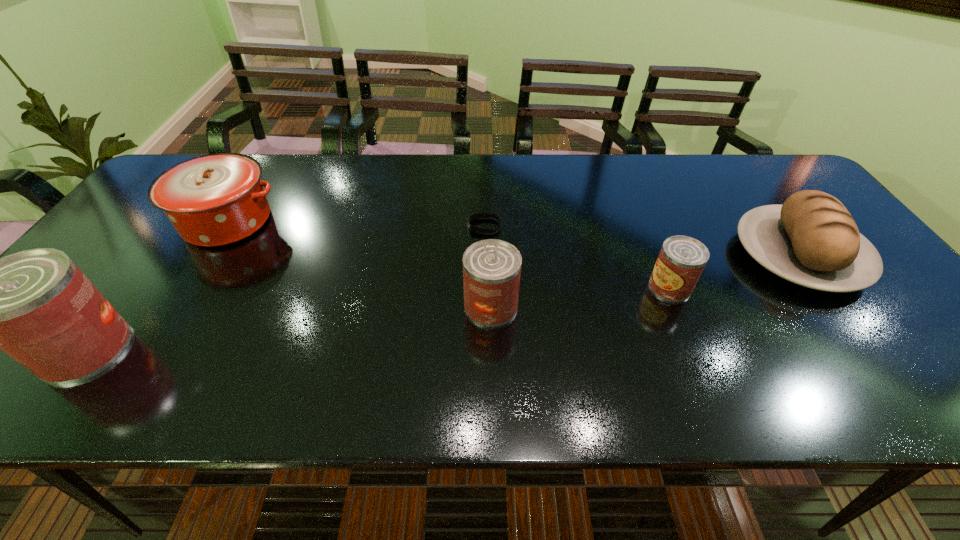
Find the location of a particular element. vacant space that satisfies the following two spatial constraints: 1. on the display of the shortest object; 2. on the left side of the bread is located at coordinates (485, 256).

The width and height of the screenshot is (960, 540). Identify the location of free location that satisfies the following two spatial constraints: 1. on the display of the shortest object; 2. on the front side of the tallest object. (486, 349).

This screenshot has width=960, height=540. I want to click on free point that satisfies the following two spatial constraints: 1. on the display of the second can from right to left; 2. on the left side of the shortest object, so click(485, 306).

Locate an element on the screen. The height and width of the screenshot is (540, 960). free space that satisfies the following two spatial constraints: 1. on the back side of the rightmost can; 2. on the display of the shortest object is located at coordinates (645, 226).